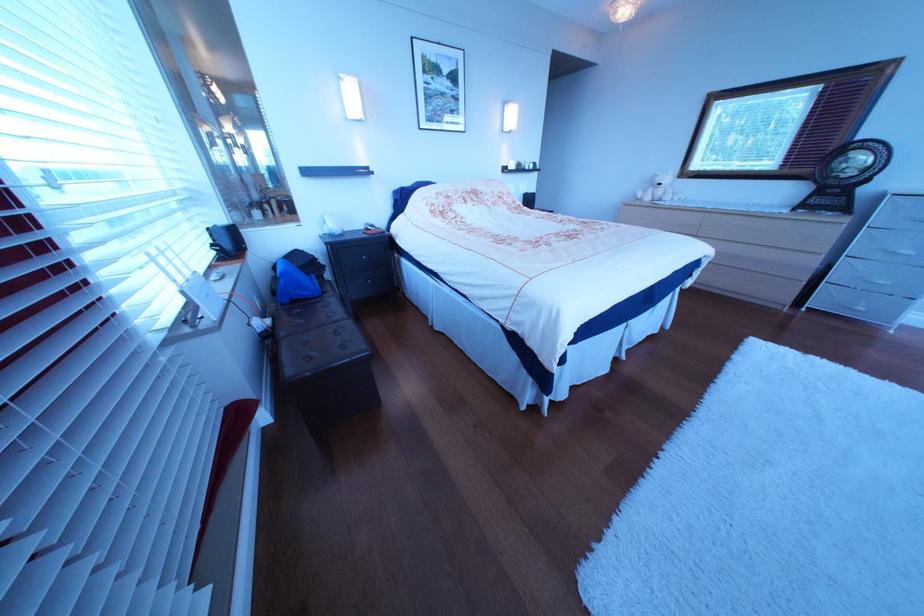
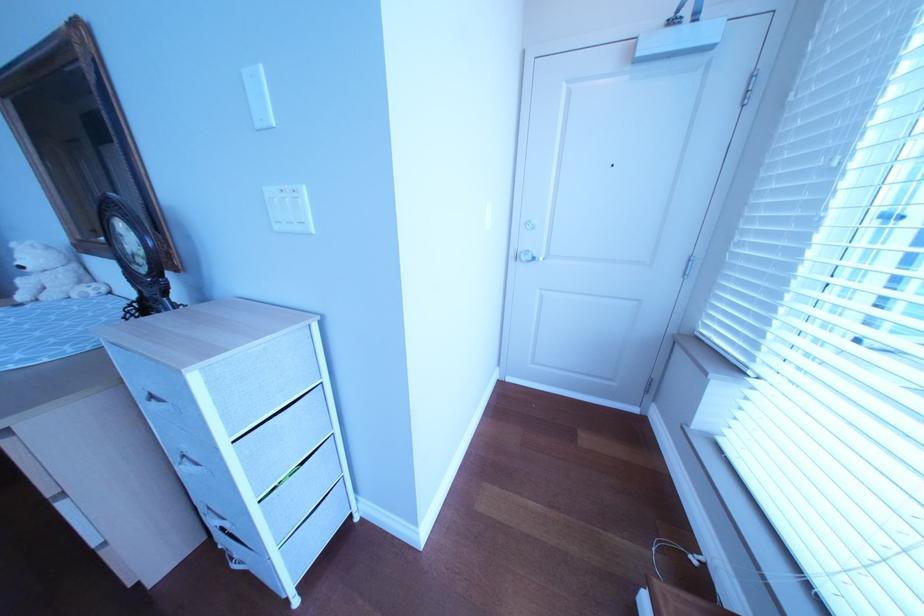
Where in the second image is the point corresponding to point (675, 187) from the first image?

(37, 270)